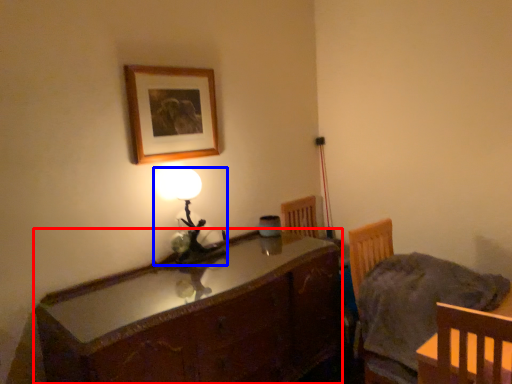
Question: Which object is further to the camera taking this photo, cabinetry (highlighted by a red box) or lamp (highlighted by a blue box)?

Choices:
 (A) cabinetry
 (B) lamp

Answer: (B)